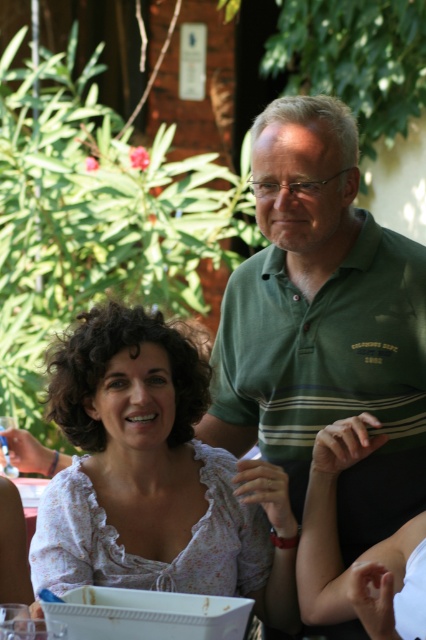
Is green striped polo shirt at center bigger than white floral blouse at center?

Indeed, green striped polo shirt at center has a larger size compared to white floral blouse at center.

Locate an element on the screen. green striped polo shirt at center is located at coordinates (322, 324).

In order to click on green striped polo shirt at center in this screenshot , I will do `click(322, 324)`.